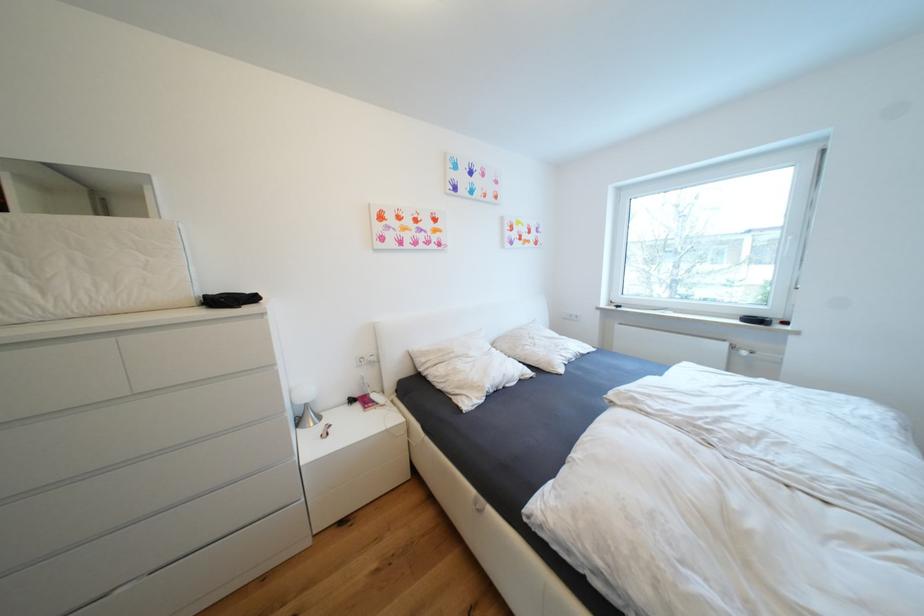
Image resolution: width=924 pixels, height=616 pixels. Find the location of `white window handle`. white window handle is located at coordinates (784, 246).